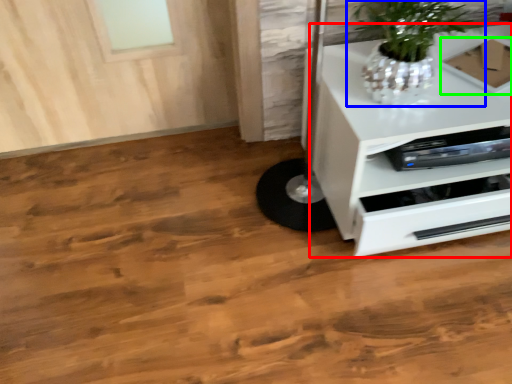
Question: Which object is the closest to the chest of drawers (highlighted by a red box)? Choose among these: houseplant (highlighted by a blue box) or cardboard box (highlighted by a green box).

Choices:
 (A) houseplant
 (B) cardboard box

Answer: (A)